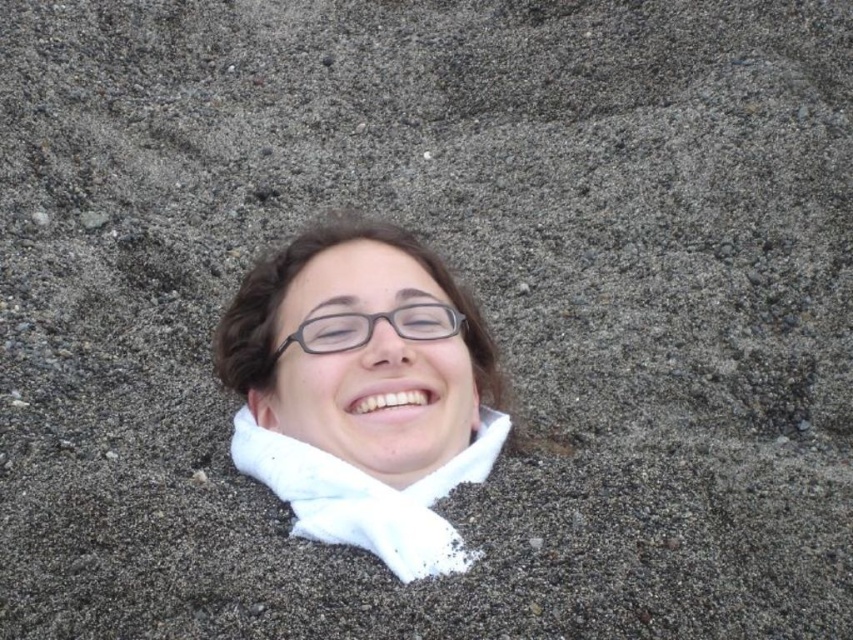
From the picture: You are a photographer taking a portrait of the person in the scene. You want to ensure the white matte scarf at center and the matte black glasses at center are both visible in the frame. Based on their positions, which object should you focus on first to make sure both are in focus?

The white matte scarf at center is below matte black glasses at center. To ensure both are in focus, focus on the matte black glasses at center first since it is closer to the camera, and the scarf below it will also be in the depth of field.

You are a photographer trying to capture a closeup shot of the person in the scene. You need to focus on both the white matte scarf at center and the matte black glasses at center. Given that your camera can only focus on objects within a 5 inch range, will you be able to capture both in focus?

The white matte scarf at center and the matte black glasses at center are 5.74 inches apart. Since the camera can only focus on objects within a 5 inch range, the distance between them exceeds the camera focus range. Therefore, you cannot capture both in focus.

You are a photographer trying to capture the person in the scene. Since you want to focus on the white matte scarf at center and the matte black glasses at center, which object should you zoom in on to ensure it takes up more space in the photo?

The white matte scarf at center is larger in size than the matte black glasses at center, so you should zoom in on the white matte scarf at center to ensure it takes up more space in the photo.